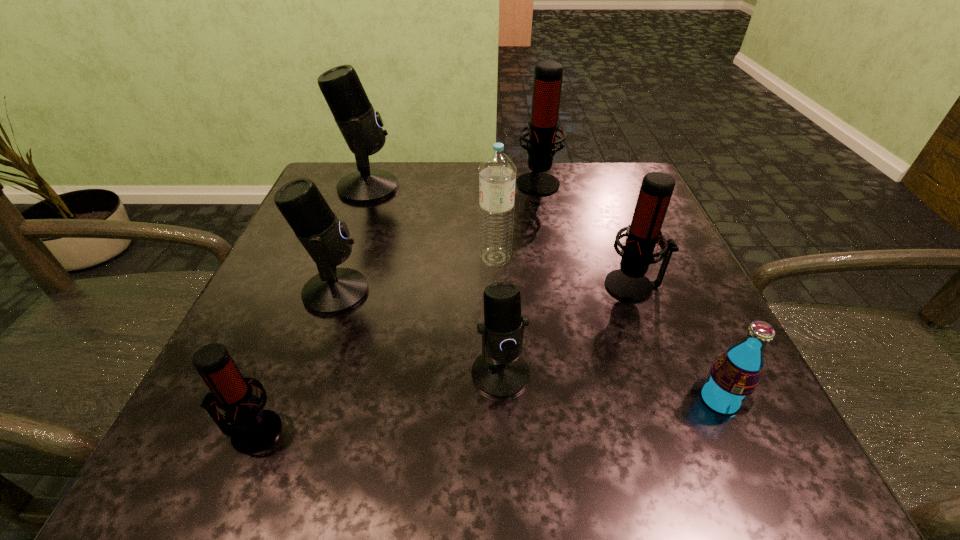
What are the coordinates of `microphone at the near edge` in the screenshot? It's located at (252, 429).

The height and width of the screenshot is (540, 960). I want to click on soda situated at the near edge, so click(x=733, y=377).

Where is `microphone that is positioned at the right edge`? microphone that is positioned at the right edge is located at coordinates (628, 283).

Find the location of `soda that is at the right edge`. soda that is at the right edge is located at coordinates (733, 377).

Where is `object that is at the far left corner`? This screenshot has height=540, width=960. object that is at the far left corner is located at coordinates (361, 127).

In order to click on object that is at the near left corner in this screenshot , I will do `click(252, 429)`.

Locate an element on the screen. object that is at the near right corner is located at coordinates [733, 377].

Locate an element on the screen. free spot at the far edge of the desktop is located at coordinates (429, 194).

Where is `vacant space at the near edge of the desktop`? The width and height of the screenshot is (960, 540). vacant space at the near edge of the desktop is located at coordinates (446, 431).

Identify the location of vacant space at the left edge of the desktop. (252, 357).